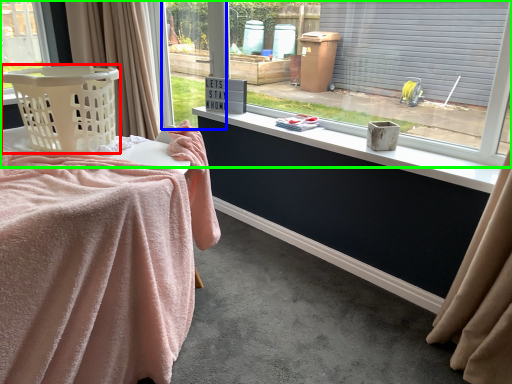
Question: Considering the real-world distances, which object is closest to basket (highlighted by a red box)? window frame (highlighted by a blue box) or window (highlighted by a green box).

Choices:
 (A) window frame
 (B) window

Answer: (B)